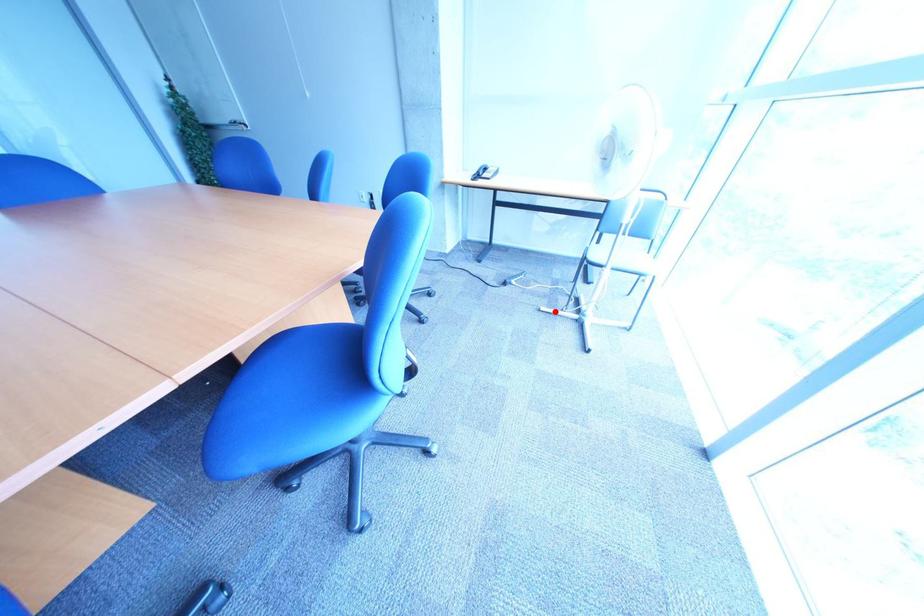
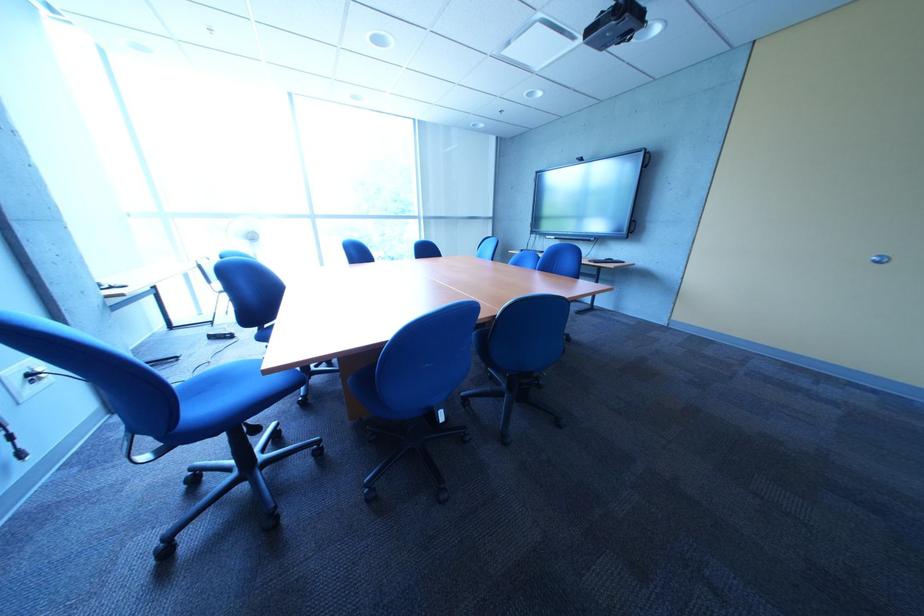
Question: I am providing you with two images of the same scene from different viewpoints. A red point is marked on the first image. At the location where the point appears in image 1, is it still visible in image 2?

Choices:
 (A) Yes
 (B) No

Answer: (B)